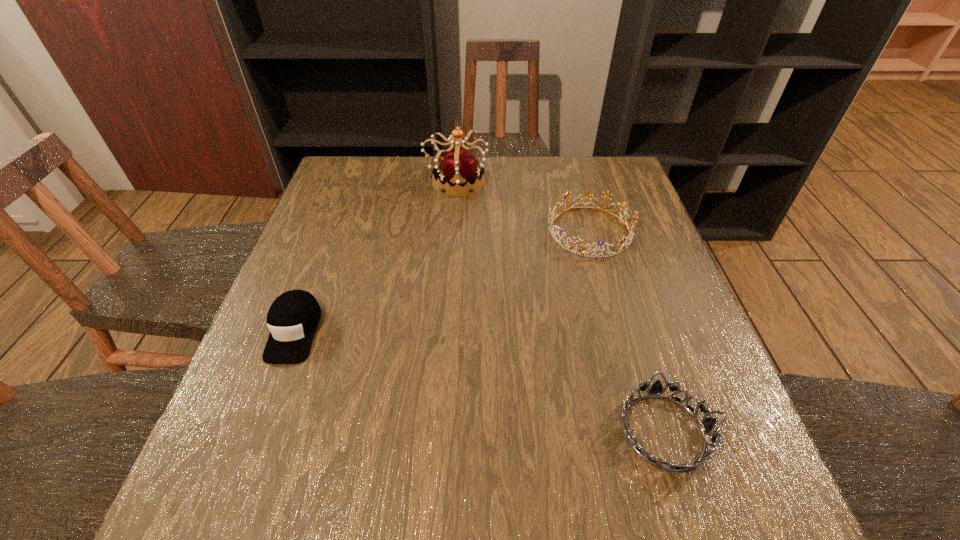
Identify the location of vacant space that satisfies the following two spatial constraints: 1. on the front-facing side of the second farthest tiara; 2. on the front-facing side of the cap. This screenshot has height=540, width=960. (617, 331).

Where is `free spot that satisfies the following two spatial constraints: 1. on the front-facing side of the tallest tiara; 2. on the front-facing side of the third farthest object`? This screenshot has width=960, height=540. free spot that satisfies the following two spatial constraints: 1. on the front-facing side of the tallest tiara; 2. on the front-facing side of the third farthest object is located at coordinates (445, 331).

The width and height of the screenshot is (960, 540). What are the coordinates of `vacant space that satisfies the following two spatial constraints: 1. on the front-facing side of the second shortest tiara; 2. on the front-facing side of the leftmost object` in the screenshot? It's located at (617, 331).